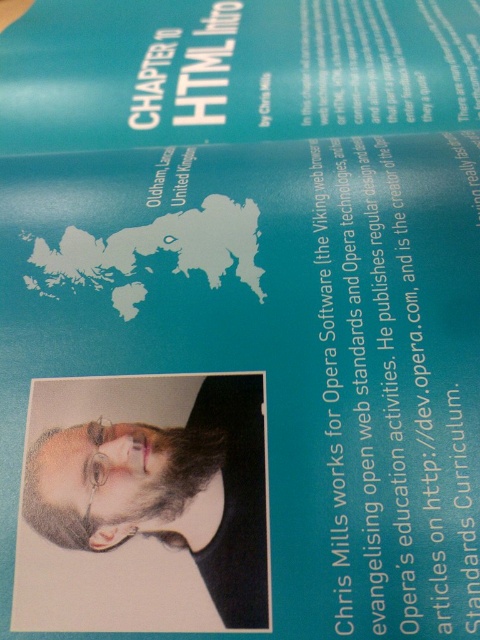
Question: Which point is farther to the camera?

Choices:
 (A) (153, 394)
 (B) (267, 122)

Answer: (B)

Question: Considering the relative positions of teal matte paper at upper center and beige paper portrait at center in the image provided, where is teal matte paper at upper center located with respect to beige paper portrait at center?

Choices:
 (A) above
 (B) below

Answer: (A)

Question: Is teal matte paper at upper center smaller than beige paper portrait at center?

Choices:
 (A) yes
 (B) no

Answer: (B)

Question: Which of the following is the farthest from the observer?

Choices:
 (A) (29, 625)
 (B) (147, 60)

Answer: (B)

Question: Among these points, which one is nearest to the camera?

Choices:
 (A) (x=36, y=70)
 (B) (x=145, y=496)

Answer: (B)

Question: Is teal matte paper at upper center thinner than beige paper portrait at center?

Choices:
 (A) yes
 (B) no

Answer: (B)